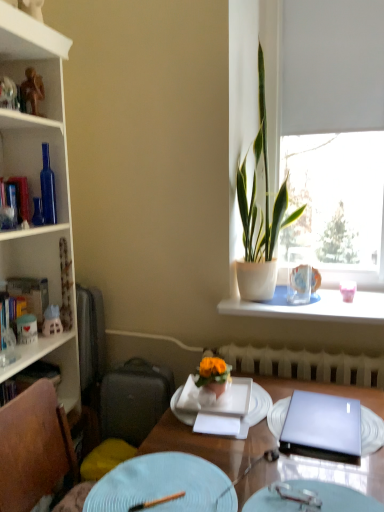
Where is `free spot behind metallic silver fork at center, which appears as the 2th tableware when viewed from the left`? The image size is (384, 512). free spot behind metallic silver fork at center, which appears as the 2th tableware when viewed from the left is located at coordinates (282, 463).